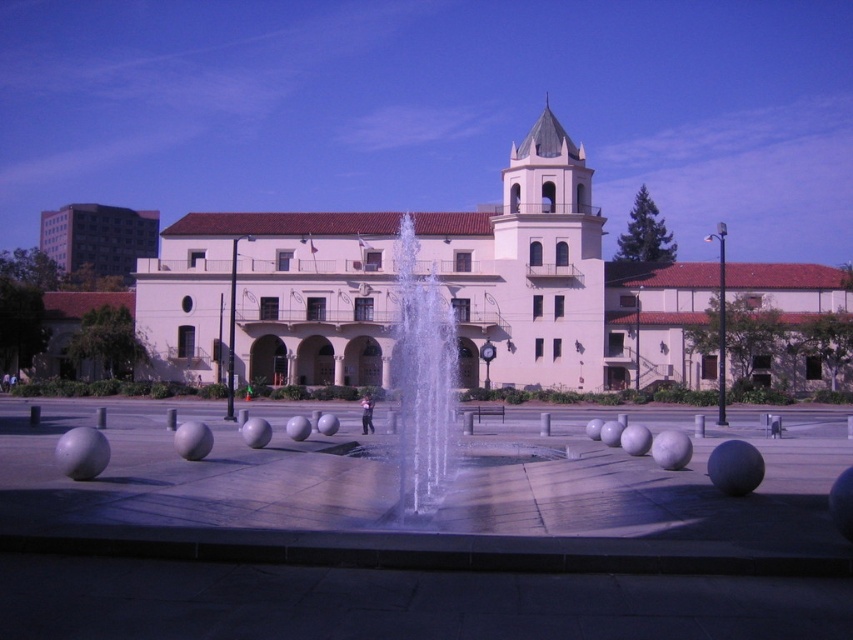
You are a visitor standing in the plaza and want to take a photo of the white stucco building at center and the clear glass water at center. Which object should you frame first in your camera to ensure both are in the shot?

You should frame the white stucco building at center first because it is wider than the clear glass water at center, so capturing its width ensures the smaller clear glass water at center will also be included in the photo.

In the scene shown: You are standing in the plaza and want to take a photo of the white stucco building at center and the clear glass water at center. Which object should you position to the left side in your camera frame?

The clear glass water at center should be positioned to the left side in your camera frame because the white stucco building at center is on the right side of it.